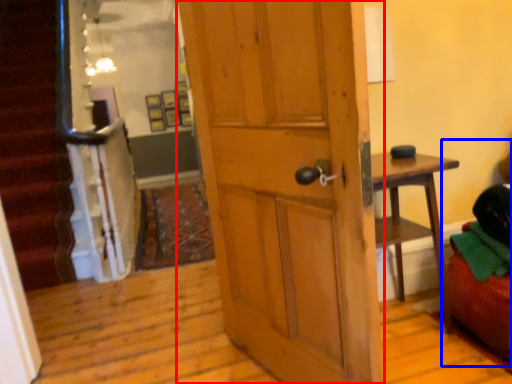
Question: Which object appears farthest to the camera in this image, door (highlighted by a red box) or bean bag chair (highlighted by a blue box)?

Choices:
 (A) door
 (B) bean bag chair

Answer: (B)